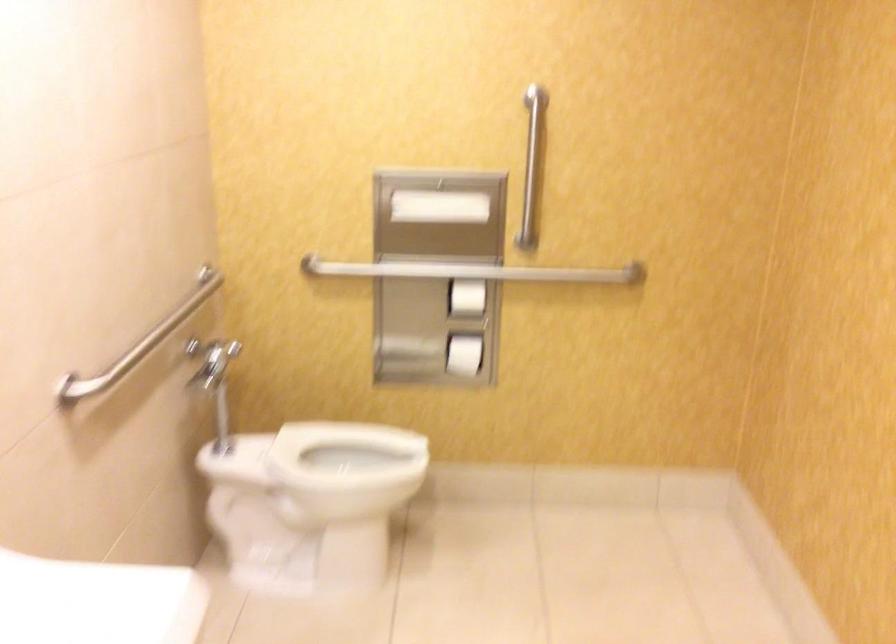
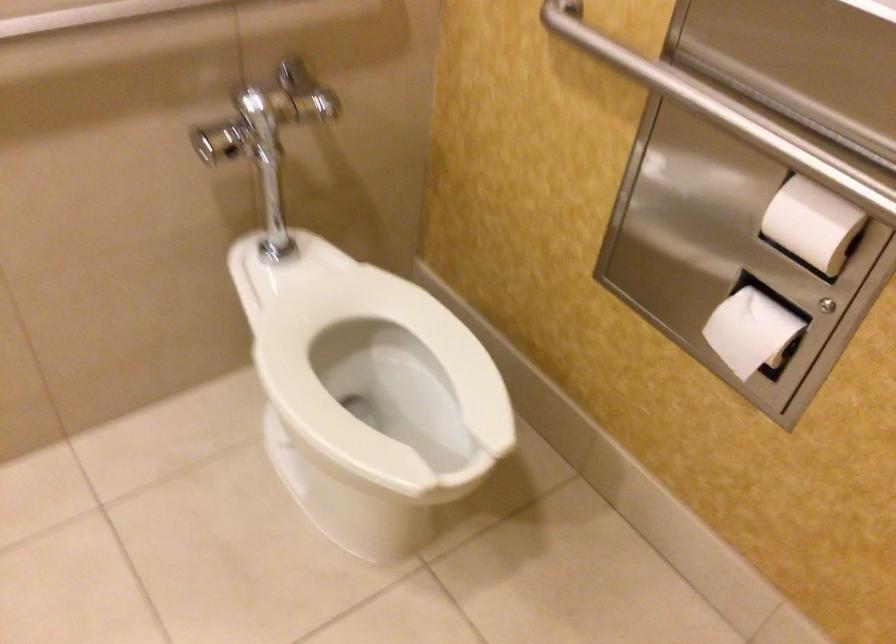
Locate, in the second image, the point that corresponds to the point at 470,352 in the first image.

(751, 330)